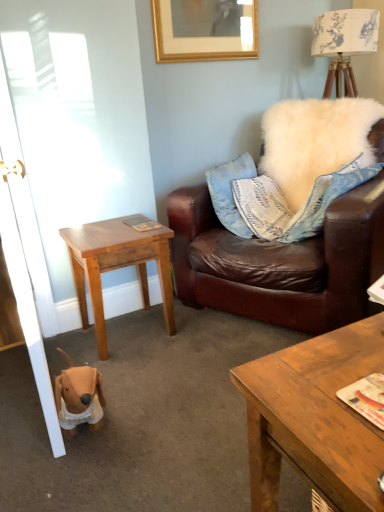
Find the location of a particular element. Image resolution: width=384 pixels, height=512 pixels. vacant space in front of light brown wooden table at lower left is located at coordinates (152, 372).